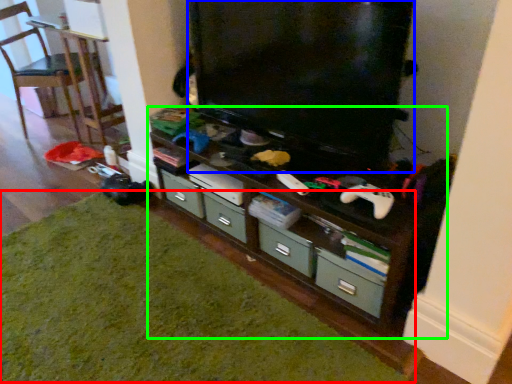
Question: Which object is the farthest from hardwood (highlighted by a red box)? Choose among these: television (highlighted by a blue box) or shelf (highlighted by a green box).

Choices:
 (A) television
 (B) shelf

Answer: (A)